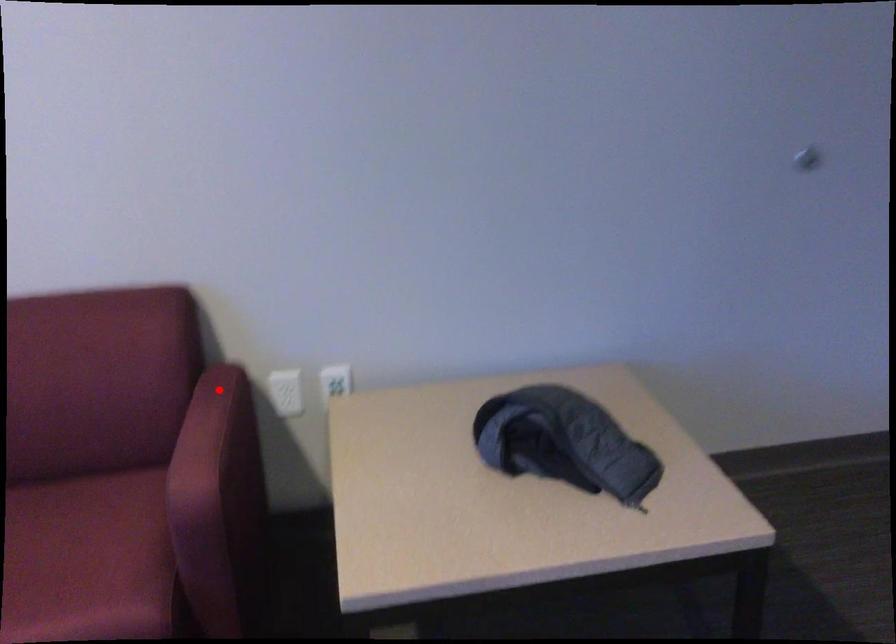
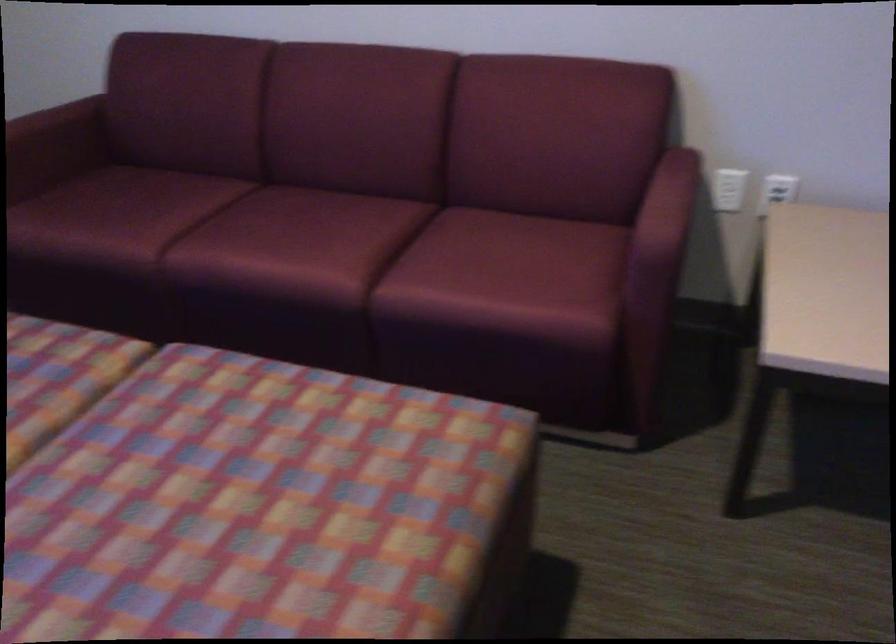
Question: I am providing you with two images of the same scene from different viewpoints. In image1, a red point is highlighted. Considering the same 3D point in image2, which of the following is correct?

Choices:
 (A) It is closer
 (B) It is farther

Answer: (B)